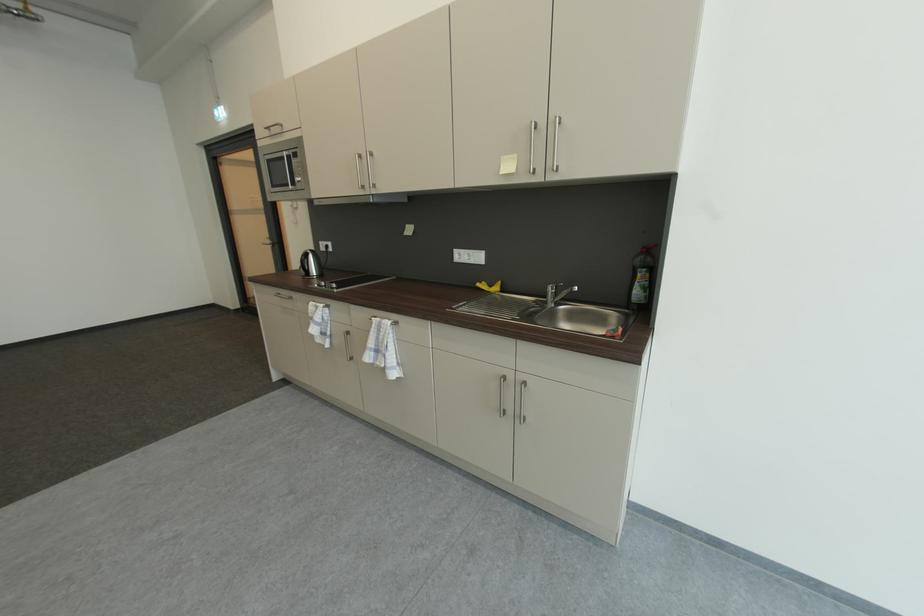
The width and height of the screenshot is (924, 616). What are the coordinates of `microwave door handle` in the screenshot? It's located at (289, 169).